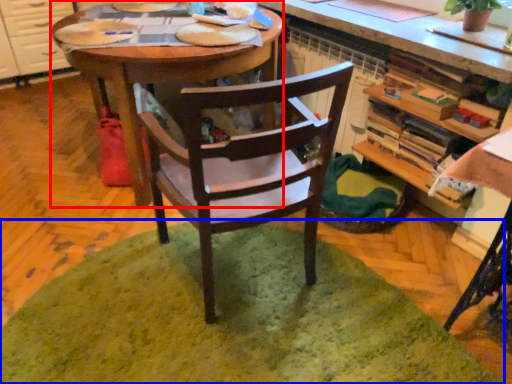
Question: Which point is further to the camera, desk (highlighted by a red box) or mat (highlighted by a blue box)?

Choices:
 (A) desk
 (B) mat

Answer: (A)